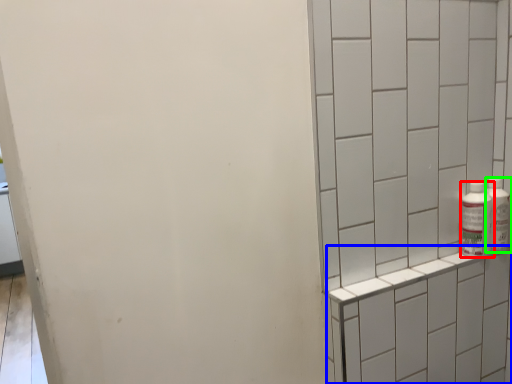
Question: Which object is the farthest from bottle (highlighted by a red box)? Choose among these: shelf (highlighted by a blue box) or bottle (highlighted by a green box).

Choices:
 (A) shelf
 (B) bottle

Answer: (A)